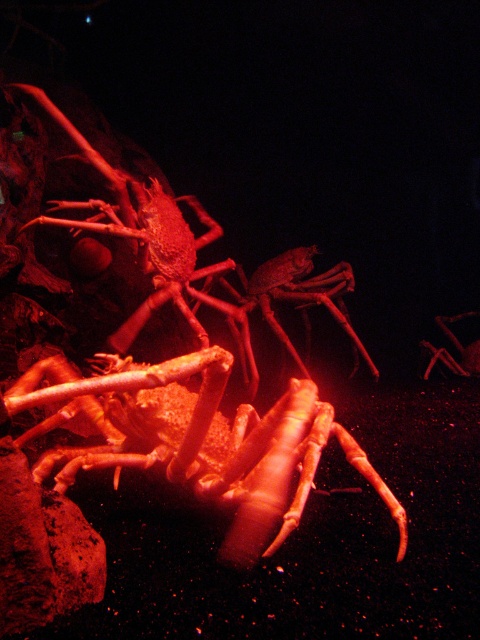
Question: Does matte orange lobster at center appear under smooth red lobster at center?

Choices:
 (A) no
 (B) yes

Answer: (B)

Question: Which point appears closest to the camera in this image?

Choices:
 (A) (204, 330)
 (B) (98, 392)

Answer: (B)

Question: Is matte orange lobster at center smaller than smooth red lobster at center?

Choices:
 (A) no
 (B) yes

Answer: (B)

Question: Can you confirm if matte orange lobster at center is thinner than smooth red lobster at center?

Choices:
 (A) no
 (B) yes

Answer: (A)

Question: Which point is closer to the camera?

Choices:
 (A) (73, 132)
 (B) (243, 458)

Answer: (B)